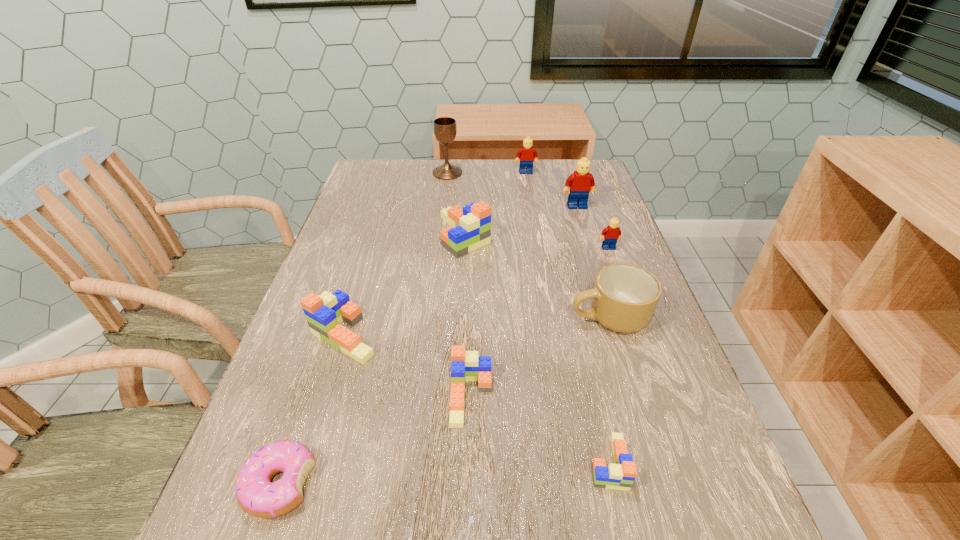
At what (x,y) coordinates should I click in order to perform the action: click on chalice. Please return your answer as a coordinate pair (x, y). Looking at the image, I should click on (445, 129).

At what (x,y) coordinates should I click in order to perform the action: click on the second farthest yellow Lego. Please return your answer as a coordinate pair (x, y). Looking at the image, I should click on (581, 182).

Identify the location of the second tallest object. This screenshot has width=960, height=540. (581, 182).

The image size is (960, 540). Identify the location of the leftmost yellow Lego. (527, 154).

The height and width of the screenshot is (540, 960). Identify the location of the farthest Lego. pyautogui.click(x=527, y=154).

Find the location of a particular element. The width and height of the screenshot is (960, 540). the farthest orange Lego is located at coordinates (472, 224).

In order to click on tan mug in this screenshot , I will do `click(624, 298)`.

This screenshot has height=540, width=960. What are the coordinates of `the third smallest orange Lego` in the screenshot? It's located at (324, 313).

Identify the location of the second farthest orange Lego. This screenshot has height=540, width=960. (324, 313).

Locate an element on the screen. This screenshot has height=540, width=960. the smallest yellow Lego is located at coordinates (612, 233).